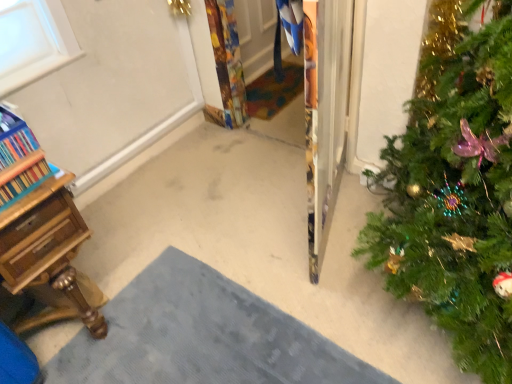
Question: From a real-world perspective, is green matte christmas tree at right physically above wooden desk at lower left?

Choices:
 (A) no
 (B) yes

Answer: (B)

Question: Is green matte christmas tree at right to the right of wooden desk at lower left from the viewer's perspective?

Choices:
 (A) no
 (B) yes

Answer: (B)

Question: From the image's perspective, does green matte christmas tree at right appear lower than wooden desk at lower left?

Choices:
 (A) yes
 (B) no

Answer: (B)

Question: Considering the relative positions of green matte christmas tree at right and wooden desk at lower left in the image provided, is green matte christmas tree at right behind wooden desk at lower left?

Choices:
 (A) no
 (B) yes

Answer: (A)

Question: Is green matte christmas tree at right turned away from wooden desk at lower left?

Choices:
 (A) yes
 (B) no

Answer: (B)

Question: From a real-world perspective, is gray textured doormat at lower center, the first doormat when ordered from bottom to top, above or below multicolored woven mat at center, which is the 1th doormat in top-to-bottom order?

Choices:
 (A) below
 (B) above

Answer: (B)

Question: In terms of height, does gray textured doormat at lower center, the 1th doormat when ordered from front to back, look taller or shorter compared to multicolored woven mat at center, which is the 1th doormat in top-to-bottom order?

Choices:
 (A) short
 (B) tall

Answer: (B)

Question: Does point (221, 312) appear closer or farther from the camera than point (257, 105)?

Choices:
 (A) farther
 (B) closer

Answer: (B)

Question: Is gray textured doormat at lower center, the 1th doormat when ordered from front to back, situated inside multicolored woven mat at center, which is counted as the 2th doormat, starting from the bottom, or outside?

Choices:
 (A) inside
 (B) outside

Answer: (B)

Question: Is point (433, 8) positioned closer to the camera than point (193, 294)?

Choices:
 (A) farther
 (B) closer

Answer: (B)

Question: From the image's perspective, relative to gray textured doormat at lower center, the first doormat when ordered from bottom to top, is green matte christmas tree at right above or below?

Choices:
 (A) below
 (B) above

Answer: (B)

Question: Considering their positions, is green matte christmas tree at right located in front of or behind gray textured doormat at lower center, the 1th doormat when ordered from front to back?

Choices:
 (A) front
 (B) behind

Answer: (A)

Question: Is green matte christmas tree at right wider or thinner than gray textured doormat at lower center, the 1th doormat when ordered from front to back?

Choices:
 (A) wide
 (B) thin

Answer: (A)

Question: Looking at their shapes, would you say wooden desk at lower left is wider or thinner than multicolored woven mat at center, the 2th doormat from the front?

Choices:
 (A) wide
 (B) thin

Answer: (B)

Question: From a real-world perspective, is wooden desk at lower left above or below multicolored woven mat at center, which is the 1th doormat in top-to-bottom order?

Choices:
 (A) above
 (B) below

Answer: (A)